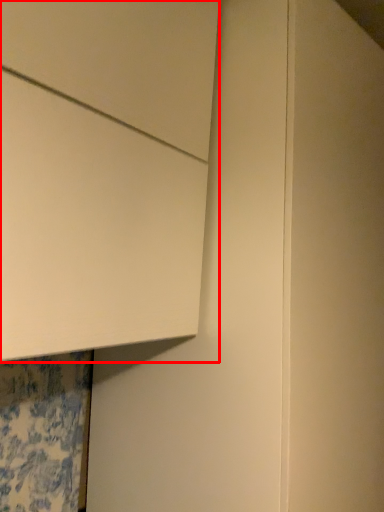
Question: From the image's perspective, where is cabinetry (annotated by the red box) located in relation to door in the image?

Choices:
 (A) above
 (B) below

Answer: (A)